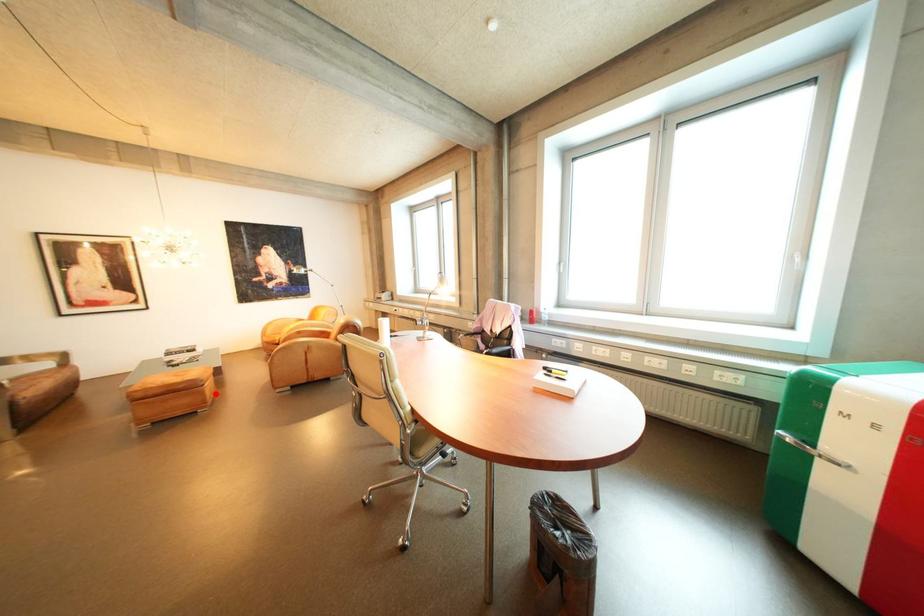
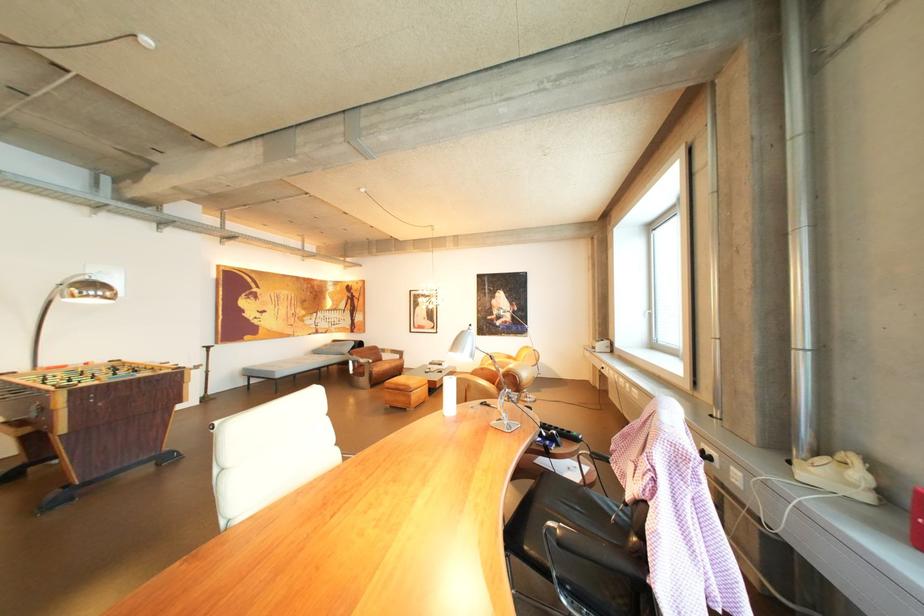
Question: I am providing you with two images of the same scene from different viewpoints. Given a red point in image1, look at the same physical point in image2. Is it:

Choices:
 (A) Closer to the viewpoint
 (B) Farther from the viewpoint

Answer: (B)